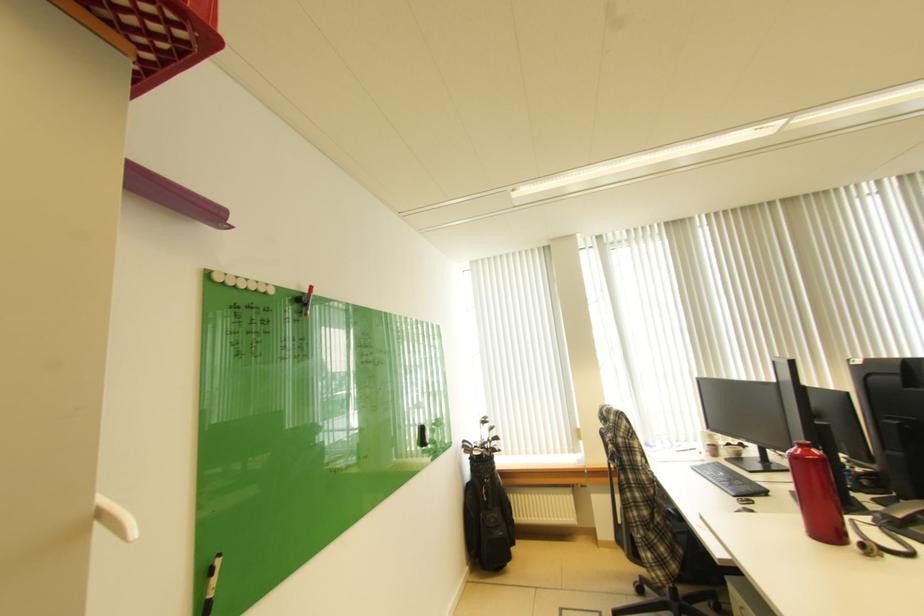
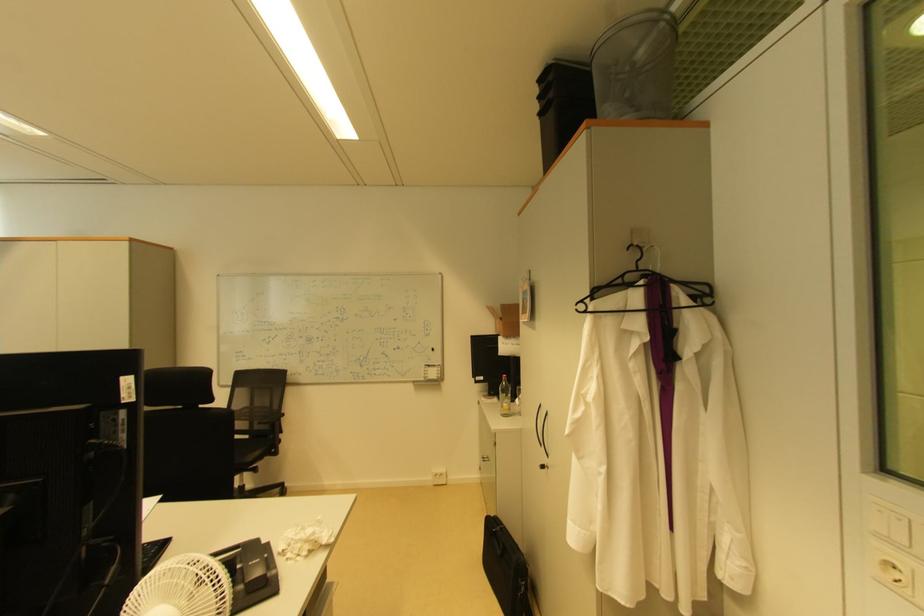
Question: The camera is either moving clockwise (left) or counter-clockwise (right) around the object. The first image is from the beginning of the video and the second image is from the end. Is the camera moving left or right when shooting the video?

Choices:
 (A) Left
 (B) Right

Answer: (A)